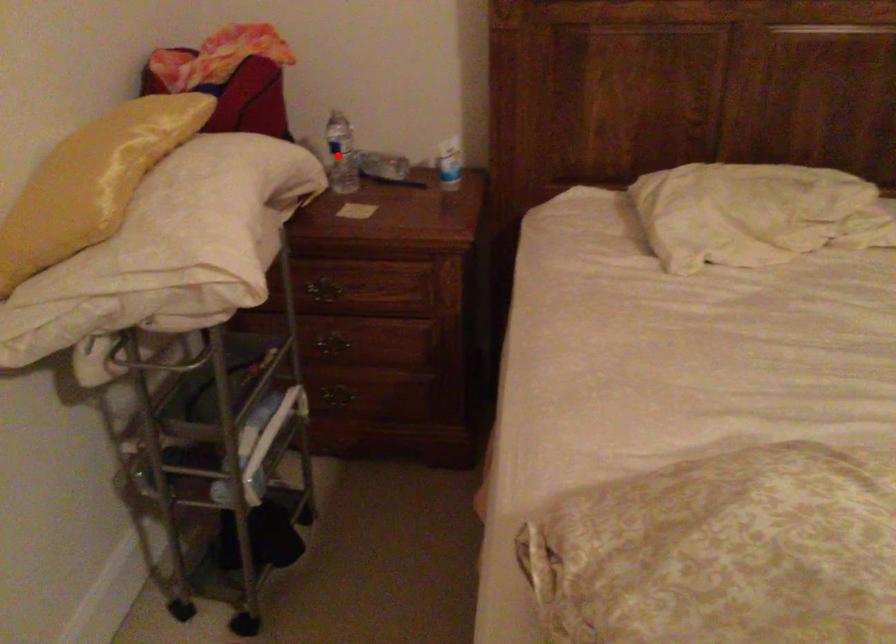
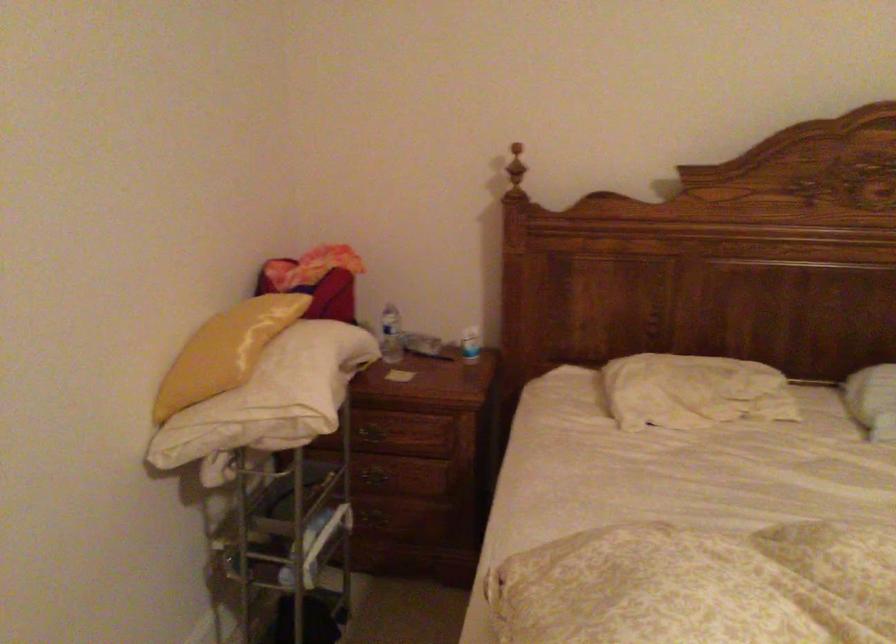
Locate, in the second image, the point that corresponds to the highlighted location in the first image.

(391, 335)